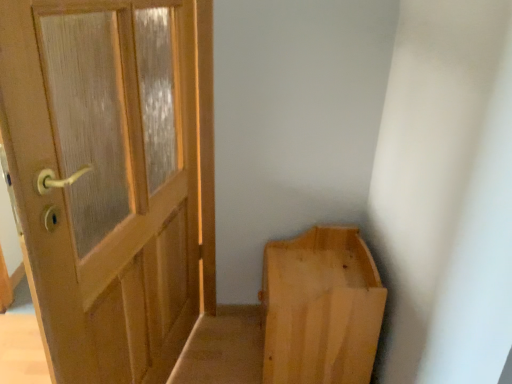
Question: Is matte wood door at left wider than light wood/rough plank bench at lower right?

Choices:
 (A) no
 (B) yes

Answer: (A)

Question: Can you confirm if matte wood door at left is bigger than light wood/rough plank bench at lower right?

Choices:
 (A) no
 (B) yes

Answer: (B)

Question: Is matte wood door at left to the left of light wood/rough plank bench at lower right from the viewer's perspective?

Choices:
 (A) yes
 (B) no

Answer: (A)

Question: Can you confirm if matte wood door at left is positioned to the right of light wood/rough plank bench at lower right?

Choices:
 (A) yes
 (B) no

Answer: (B)

Question: From a real-world perspective, is matte wood door at left physically below light wood/rough plank bench at lower right?

Choices:
 (A) yes
 (B) no

Answer: (B)

Question: Is the depth of matte wood door at left greater than that of light wood/rough plank bench at lower right?

Choices:
 (A) yes
 (B) no

Answer: (B)

Question: Considering the relative sizes of light wood/rough plank bench at lower right and matte wood door at left in the image provided, is light wood/rough plank bench at lower right bigger than matte wood door at left?

Choices:
 (A) no
 (B) yes

Answer: (A)

Question: From a real-world perspective, is light wood/rough plank bench at lower right physically above matte wood door at left?

Choices:
 (A) yes
 (B) no

Answer: (B)

Question: From the image's perspective, is light wood/rough plank bench at lower right below matte wood door at left?

Choices:
 (A) no
 (B) yes

Answer: (B)

Question: Considering the relative sizes of light wood/rough plank bench at lower right and matte wood door at left in the image provided, is light wood/rough plank bench at lower right thinner than matte wood door at left?

Choices:
 (A) no
 (B) yes

Answer: (A)

Question: Considering the relative positions of light wood/rough plank bench at lower right and matte wood door at left in the image provided, is light wood/rough plank bench at lower right to the right of matte wood door at left from the viewer's perspective?

Choices:
 (A) no
 (B) yes

Answer: (B)

Question: From a real-world perspective, is light wood/rough plank bench at lower right beneath matte wood door at left?

Choices:
 (A) yes
 (B) no

Answer: (A)

Question: From a real-world perspective, is matte wood door at left positioned above or below light wood/rough plank bench at lower right?

Choices:
 (A) below
 (B) above

Answer: (B)